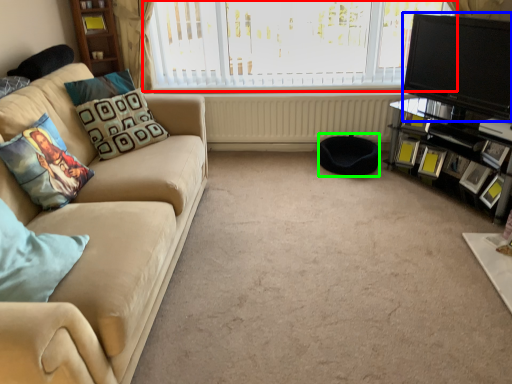
Question: Which is nearer to the window (highlighted by a red box)? television (highlighted by a blue box) or footrest (highlighted by a green box).

Choices:
 (A) television
 (B) footrest

Answer: (A)